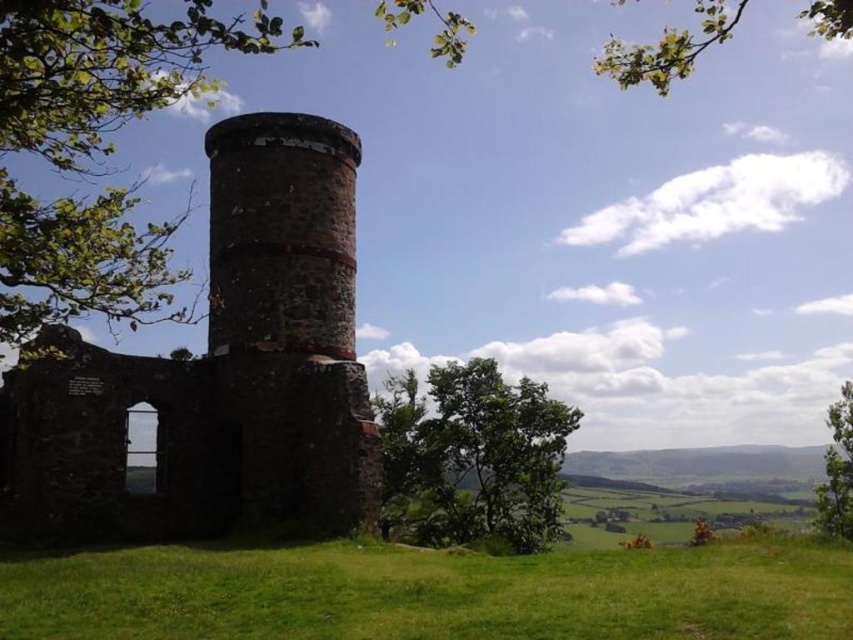
Between green leafy tree at upper left and green leafy tree at lower right, which one appears on the left side from the viewer's perspective?

green leafy tree at upper left

Is green leafy tree at upper left further to the viewer compared to green leafy tree at lower right?

No, green leafy tree at upper left is in front of green leafy tree at lower right.

At what (x,y) coordinates should I click in order to perform the action: click on green leafy tree at upper left. Please return your answer as a coordinate pair (x, y). The height and width of the screenshot is (640, 853). Looking at the image, I should click on (350, 138).

Who is positioned more to the left, rustic stone tower at center or green grass at lower center?

From the viewer's perspective, rustic stone tower at center appears more on the left side.

Can you confirm if rustic stone tower at center is positioned below green grass at lower center?

Actually, rustic stone tower at center is above green grass at lower center.

This screenshot has width=853, height=640. I want to click on rustic stone tower at center, so (x=218, y=371).

Image resolution: width=853 pixels, height=640 pixels. In order to click on rustic stone tower at center in this screenshot , I will do `click(218, 371)`.

How distant is green leafy tree at upper left from green leafy tree at center?

A distance of 27.86 meters exists between green leafy tree at upper left and green leafy tree at center.

Who is more distant from viewer, (502, 61) or (508, 476)?

The point (502, 61) is more distant.

Find the location of a particular element. green leafy tree at upper left is located at coordinates (350, 138).